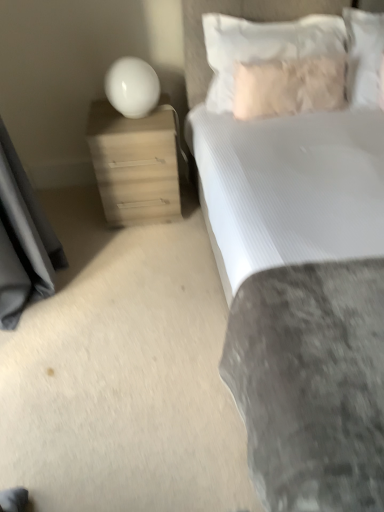
Question: Does white glossy sphere at upper left have a greater width compared to white soft pillow at upper right, which is the 3th pillow from right to left?

Choices:
 (A) yes
 (B) no

Answer: (B)

Question: Considering the relative positions of white glossy sphere at upper left and white soft pillow at upper right, which is the 3th pillow from right to left, in the image provided, is white glossy sphere at upper left to the right of white soft pillow at upper right, which is the 3th pillow from right to left, from the viewer's perspective?

Choices:
 (A) yes
 (B) no

Answer: (B)

Question: Is the position of white glossy sphere at upper left less distant than that of white soft pillow at upper right, which is the 3th pillow from right to left?

Choices:
 (A) yes
 (B) no

Answer: (B)

Question: Can you confirm if white glossy sphere at upper left is taller than white soft pillow at upper right, the 1th pillow positioned from the left?

Choices:
 (A) yes
 (B) no

Answer: (B)

Question: From the image's perspective, does white glossy sphere at upper left appear higher than white soft pillow at upper right, the 1th pillow positioned from the left?

Choices:
 (A) no
 (B) yes

Answer: (A)

Question: Can you confirm if white glossy sphere at upper left is bigger than white soft pillow at upper right, the 1th pillow positioned from the left?

Choices:
 (A) yes
 (B) no

Answer: (B)

Question: Is the position of white glossy sphere at upper left less distant than that of white textured bed at upper right?

Choices:
 (A) no
 (B) yes

Answer: (A)

Question: Is white glossy sphere at upper left facing away from white textured bed at upper right?

Choices:
 (A) yes
 (B) no

Answer: (B)

Question: Is white glossy sphere at upper left to the right of white textured bed at upper right from the viewer's perspective?

Choices:
 (A) yes
 (B) no

Answer: (B)

Question: From a real-world perspective, is white glossy sphere at upper left physically above white textured bed at upper right?

Choices:
 (A) no
 (B) yes

Answer: (B)

Question: Is white glossy sphere at upper left not close to white textured bed at upper right?

Choices:
 (A) no
 (B) yes

Answer: (B)

Question: From a real-world perspective, is white glossy sphere at upper left positioned under white textured bed at upper right based on gravity?

Choices:
 (A) yes
 (B) no

Answer: (B)

Question: Is white textured bed at upper right positioned beyond the bounds of white glossy sphere at upper left?

Choices:
 (A) yes
 (B) no

Answer: (A)